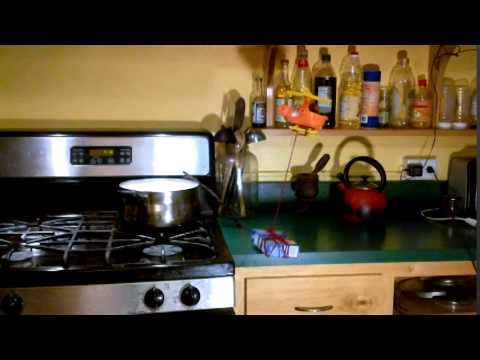
Locate an element on the screen. This screenshot has width=480, height=360. outlet is located at coordinates (423, 162).